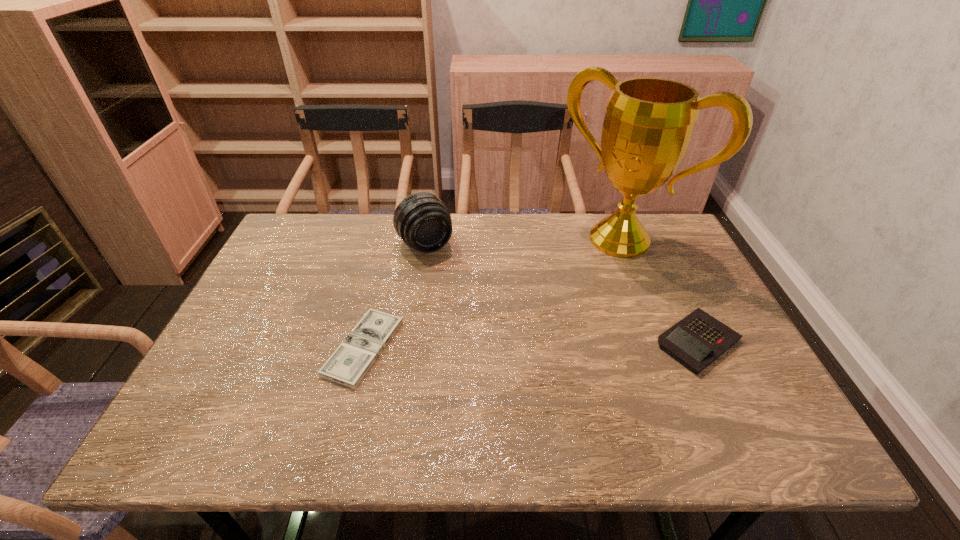
The height and width of the screenshot is (540, 960). I want to click on free space on the desktop that is between the shortest object and the calculator and is positioned on the front-facing side of the tallest object, so tap(526, 345).

Where is `free space on the desktop that is between the dollar and the calculator and is positioned at the front element of the telephoto lens`? The width and height of the screenshot is (960, 540). free space on the desktop that is between the dollar and the calculator and is positioned at the front element of the telephoto lens is located at coordinates (493, 346).